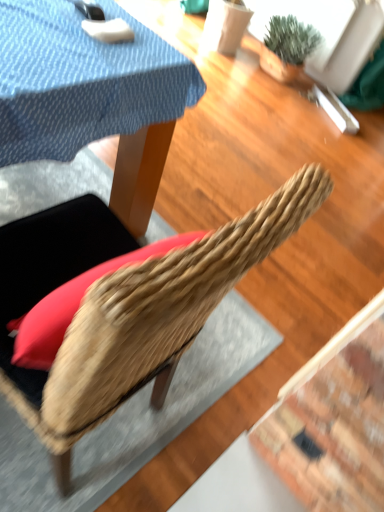
Question: From a real-world perspective, is woven wood chair at center above or below green textured plant at upper right?

Choices:
 (A) above
 (B) below

Answer: (A)

Question: In terms of size, does woven wood chair at center appear bigger or smaller than green textured plant at upper right?

Choices:
 (A) big
 (B) small

Answer: (A)

Question: Considering the positions of woven wood chair at center and green textured plant at upper right in the image, is woven wood chair at center taller or shorter than green textured plant at upper right?

Choices:
 (A) tall
 (B) short

Answer: (A)

Question: Considering the positions of green textured plant at upper right and woven wood chair at center in the image, is green textured plant at upper right wider or thinner than woven wood chair at center?

Choices:
 (A) thin
 (B) wide

Answer: (A)

Question: From a real-world perspective, relative to woven wood chair at center, is green textured plant at upper right vertically above or below?

Choices:
 (A) above
 (B) below

Answer: (B)

Question: From the image's perspective, is green textured plant at upper right positioned above or below woven wood chair at center?

Choices:
 (A) below
 (B) above

Answer: (B)

Question: Would you say green textured plant at upper right is inside or outside woven wood chair at center?

Choices:
 (A) inside
 (B) outside

Answer: (B)